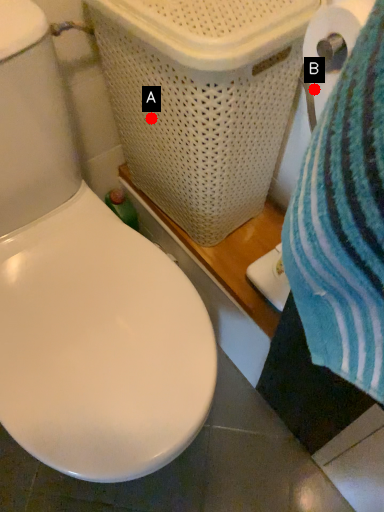
Question: Two points are circled on the image, labeled by A and B beside each circle. Which point appears closest to the camera in this image?

Choices:
 (A) A is closer
 (B) B is closer

Answer: (B)